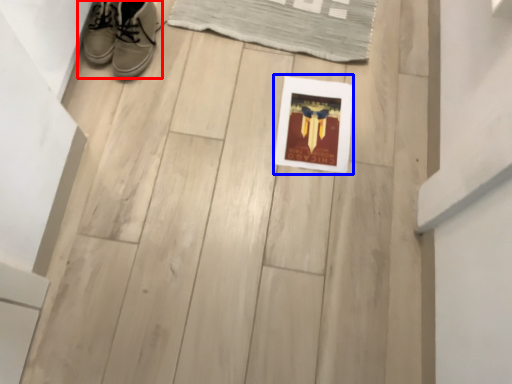
Question: Which of the following is the closest to the observer, footwear (highlighted by a red box) or picture frame (highlighted by a blue box)?

Choices:
 (A) footwear
 (B) picture frame

Answer: (A)